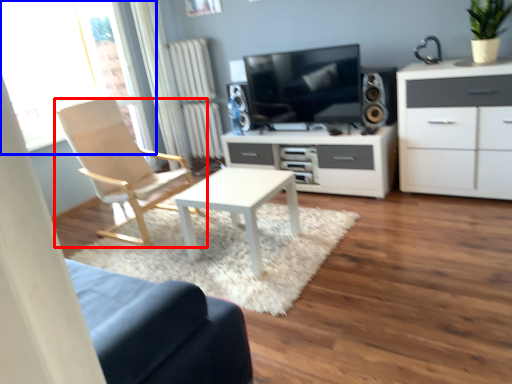
Question: Among these objects, which one is farthest to the camera, chair (highlighted by a red box) or window (highlighted by a blue box)?

Choices:
 (A) chair
 (B) window

Answer: (B)